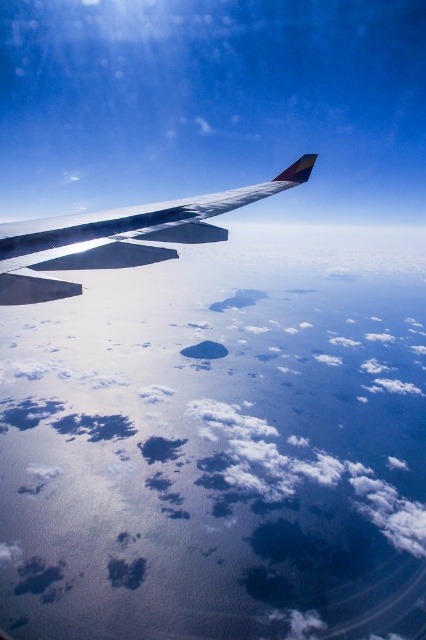
Does white fluffy cloud at upper center have a larger size compared to metallic silver wing at upper left?

Correct, white fluffy cloud at upper center is larger in size than metallic silver wing at upper left.

Find the location of a particular element. This screenshot has width=426, height=640. white fluffy cloud at upper center is located at coordinates (221, 444).